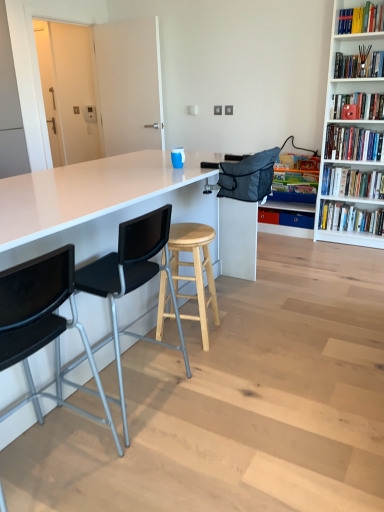
Identify the location of free location to the right of black plastic chair at left, the second chair positioned from the front. The image size is (384, 512). (211, 394).